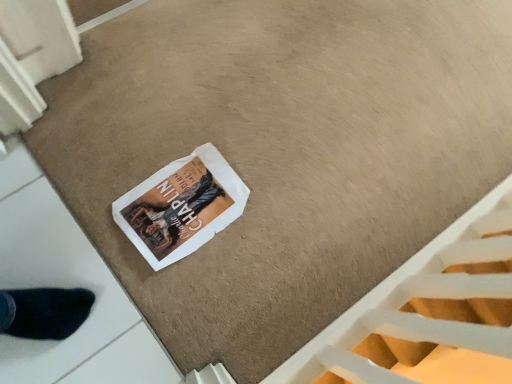
Question: Is point (406, 294) positioned closer to the camera than point (170, 235)?

Choices:
 (A) farther
 (B) closer

Answer: (A)

Question: In terms of size, does white textured stairwell at lower right appear bigger or smaller than white paper magazine at center?

Choices:
 (A) big
 (B) small

Answer: (A)

Question: Is white textured stairwell at lower right inside or outside of white paper magazine at center?

Choices:
 (A) outside
 (B) inside

Answer: (A)

Question: Considering the positions of white paper magazine at center and white textured stairwell at lower right in the image, is white paper magazine at center taller or shorter than white textured stairwell at lower right?

Choices:
 (A) short
 (B) tall

Answer: (A)

Question: Do you think white paper magazine at center is within white textured stairwell at lower right, or outside of it?

Choices:
 (A) inside
 (B) outside

Answer: (B)

Question: Is point (187, 228) closer or farther from the camera than point (448, 251)?

Choices:
 (A) farther
 (B) closer

Answer: (B)

Question: In terms of width, does white paper magazine at center look wider or thinner when compared to white textured stairwell at lower right?

Choices:
 (A) wide
 (B) thin

Answer: (A)